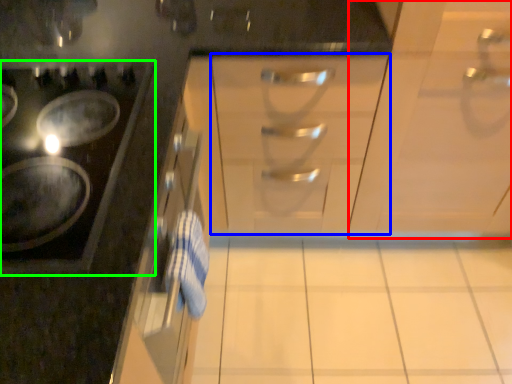
Question: Which object is positioned farthest from cabinetry (highlighted by a red box)? Select from drawer (highlighted by a blue box) and gas stove (highlighted by a green box).

Choices:
 (A) drawer
 (B) gas stove

Answer: (B)